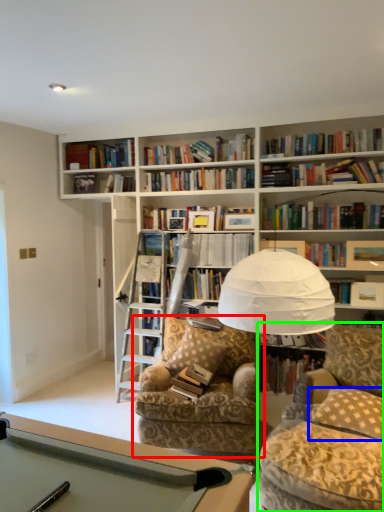
Question: Which object is the closest to the chair (highlighted by a red box)? Choose among these: pillow (highlighted by a blue box) or swivel chair (highlighted by a green box).

Choices:
 (A) pillow
 (B) swivel chair

Answer: (B)